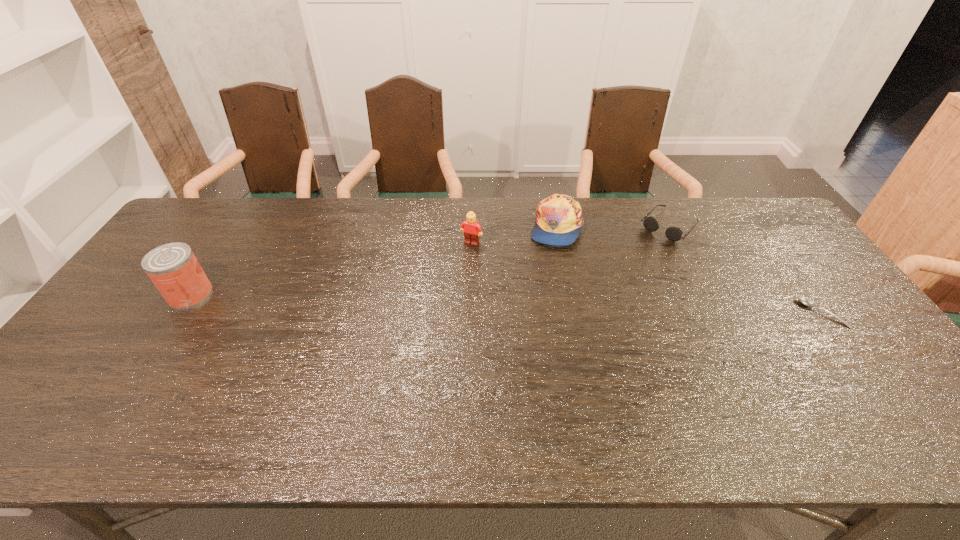
Locate an element on the screen. This screenshot has width=960, height=540. free region at the near right corner of the desktop is located at coordinates (835, 376).

The width and height of the screenshot is (960, 540). Identify the location of free space between the Lego and the can. (331, 269).

At what (x,y) coordinates should I click in order to perform the action: click on empty space that is in between the fourth object from right to left and the tallest object. Please return your answer as a coordinate pair (x, y). Looking at the image, I should click on (331, 269).

The width and height of the screenshot is (960, 540). In order to click on blank region between the Lego and the soupspoon in this screenshot , I will do [x=647, y=278].

Where is `free space between the third object from right to left and the sunglasses`? The height and width of the screenshot is (540, 960). free space between the third object from right to left and the sunglasses is located at coordinates (612, 226).

You are a GUI agent. You are given a task and a screenshot of the screen. Output one action in this format:
    pyautogui.click(x=<x>, y=<y>)
    Task: Click on the vacant area between the shortest object and the cap
    The height and width of the screenshot is (540, 960).
    Given the screenshot: What is the action you would take?
    pyautogui.click(x=689, y=270)

Identify the location of vacant space in between the third shortest object and the Lego. (514, 235).

Find the location of a particular element. free space between the soupspoon and the second object from right to left is located at coordinates (746, 269).

Image resolution: width=960 pixels, height=540 pixels. I want to click on vacant area that lies between the can and the shortest object, so click(507, 304).

Image resolution: width=960 pixels, height=540 pixels. Identify the location of vacant space that's between the rightmost object and the leftmost object. (507, 304).